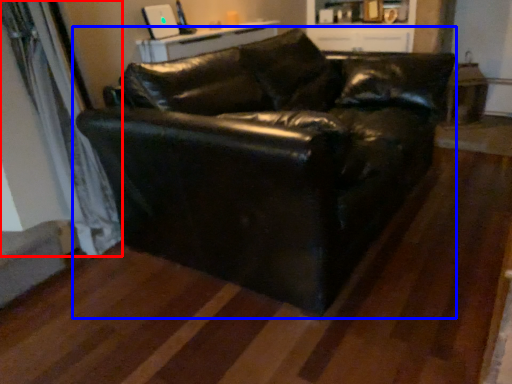
Question: Among these objects, which one is nearest to the camera, curtain (highlighted by a red box) or studio couch (highlighted by a blue box)?

Choices:
 (A) curtain
 (B) studio couch

Answer: (B)